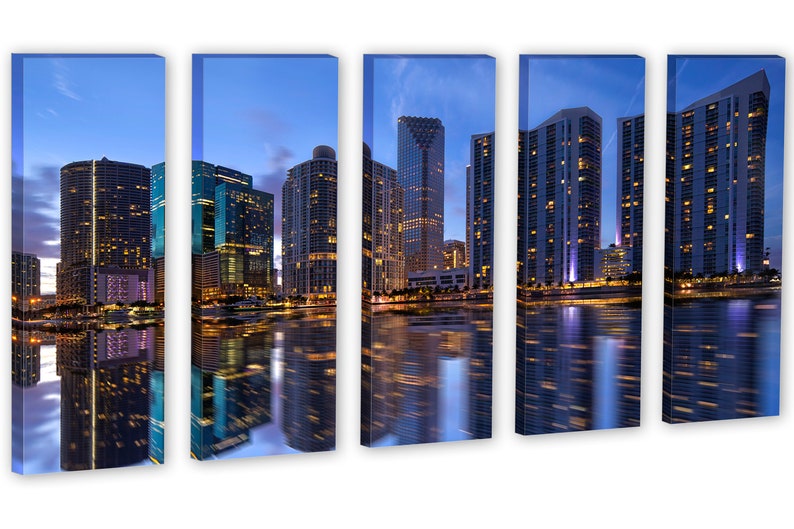
Identify the location of lights. This screenshot has height=529, width=794. (568, 277).